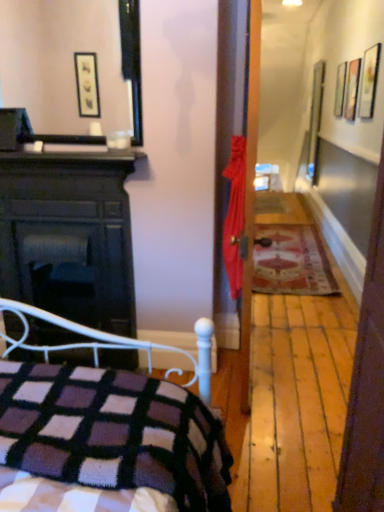
Question: Is knitted wool blanket at lower left positioned beyond the bounds of wooden picture frame at upper right?

Choices:
 (A) yes
 (B) no

Answer: (A)

Question: From a real-world perspective, is knitted wool blanket at lower left on wooden picture frame at upper right?

Choices:
 (A) yes
 (B) no

Answer: (B)

Question: Can you confirm if knitted wool blanket at lower left is positioned to the left of wooden picture frame at upper right?

Choices:
 (A) no
 (B) yes

Answer: (B)

Question: Is knitted wool blanket at lower left looking in the opposite direction of wooden picture frame at upper right?

Choices:
 (A) no
 (B) yes

Answer: (A)

Question: Does knitted wool blanket at lower left appear on the right side of wooden picture frame at upper right?

Choices:
 (A) yes
 (B) no

Answer: (B)

Question: Is knitted wool blanket at lower left placed right next to wooden picture frame at upper right?

Choices:
 (A) no
 (B) yes

Answer: (A)

Question: From a real-world perspective, is dark wood fireplace at left positioned over wooden picture frame at upper right based on gravity?

Choices:
 (A) no
 (B) yes

Answer: (A)

Question: Is wooden picture frame at upper right a part of dark wood fireplace at left?

Choices:
 (A) no
 (B) yes

Answer: (A)

Question: Is dark wood fireplace at left shorter than wooden picture frame at upper right?

Choices:
 (A) yes
 (B) no

Answer: (B)

Question: Is dark wood fireplace at left oriented away from wooden picture frame at upper right?

Choices:
 (A) no
 (B) yes

Answer: (A)

Question: Is dark wood fireplace at left beside wooden picture frame at upper right?

Choices:
 (A) yes
 (B) no

Answer: (B)

Question: Is dark wood fireplace at left not close to wooden picture frame at upper right?

Choices:
 (A) no
 (B) yes

Answer: (B)

Question: Is dark wood fireplace at left a part of wooden picture frame at upper right?

Choices:
 (A) no
 (B) yes

Answer: (A)